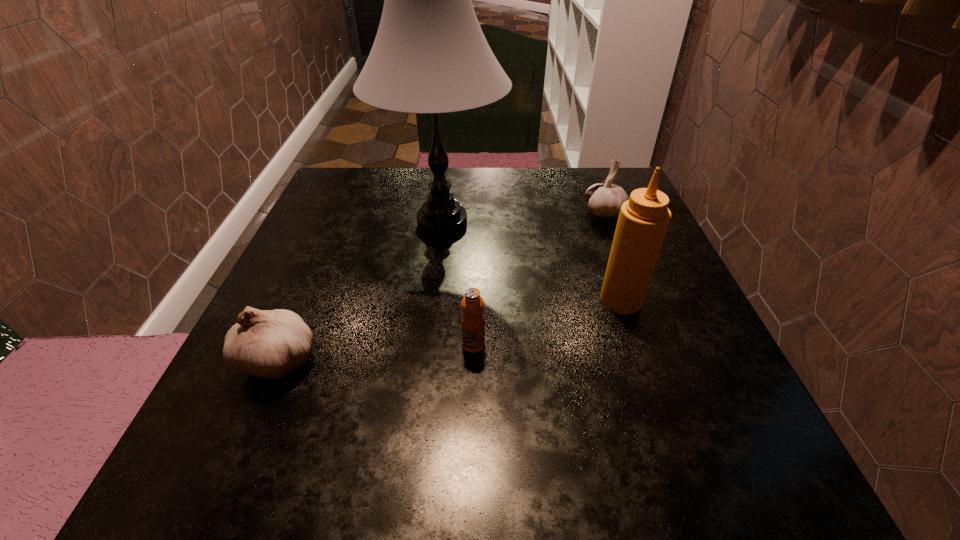
Locate an element on the screen. Image resolution: width=960 pixels, height=540 pixels. the tallest object is located at coordinates (430, 56).

Identify the location of the second tallest object. The height and width of the screenshot is (540, 960). click(643, 221).

The image size is (960, 540). In order to click on condiment in this screenshot , I will do `click(643, 221)`.

The width and height of the screenshot is (960, 540). In order to click on the farther garlic in this screenshot , I will do `click(604, 200)`.

Locate an element on the screen. The image size is (960, 540). the nearer garlic is located at coordinates [x=269, y=344].

Image resolution: width=960 pixels, height=540 pixels. I want to click on the left garlic, so click(x=269, y=344).

This screenshot has width=960, height=540. Find the location of `orange juice`. orange juice is located at coordinates (473, 322).

Locate an element on the screen. blank area located on the right of the tallest object is located at coordinates (602, 223).

In order to click on vacant space located on the back of the third nearest object in this screenshot , I will do `click(583, 190)`.

Find the location of a particular element. free space located on the back of the farther garlic is located at coordinates (588, 169).